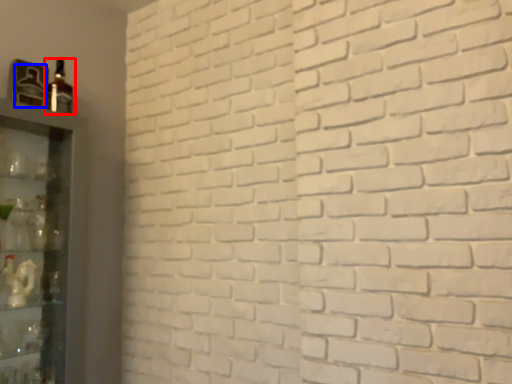
Question: Which object is closer to the camera taking this photo, bottle (highlighted by a red box) or bottle (highlighted by a blue box)?

Choices:
 (A) bottle
 (B) bottle

Answer: (B)